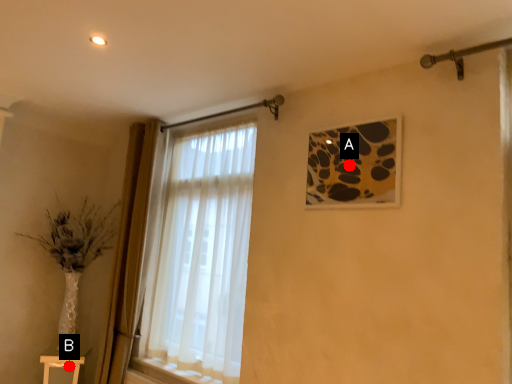
Question: Two points are circled on the image, labeled by A and B beside each circle. Which point is further to the camera?

Choices:
 (A) A is further
 (B) B is further

Answer: (B)